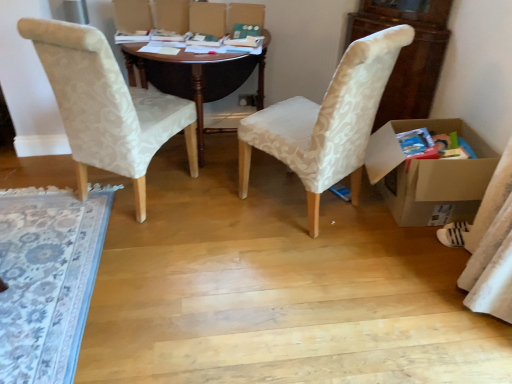
What is the approximate height of cardboard box at right?

cardboard box at right is 17.64 inches tall.

The image size is (512, 384). I want to click on white fabric sock at lower right, so click(453, 234).

What do you see at coordinates (106, 106) in the screenshot?
I see `matte white fabric chair at left, marked as the first chair in a left-to-right arrangement` at bounding box center [106, 106].

At what (x,y) coordinates should I click in order to perform the action: click on cardboard box at right. Please return your answer as a coordinate pair (x, y). This screenshot has height=384, width=512. Looking at the image, I should click on (426, 177).

Which object is positioned more to the left, patterned fabric rug at left or white fabric sock at lower right?

patterned fabric rug at left.

From a real-world perspective, is patterned fabric rug at left located higher than white fabric sock at lower right?

Incorrect, from a real-world perspective, patterned fabric rug at left is lower than white fabric sock at lower right.

Considering the relative sizes of patterned fabric rug at left and white fabric sock at lower right in the image provided, is patterned fabric rug at left thinner than white fabric sock at lower right?

No.

Considering the sizes of objects patterned fabric rug at left and white fabric sock at lower right in the image provided, who is smaller, patterned fabric rug at left or white fabric sock at lower right?

white fabric sock at lower right.

In the scene shown: Which is in front, matte white fabric chair at left, marked as the first chair in a left-to-right arrangement, or white fabric sock at lower right?

matte white fabric chair at left, marked as the first chair in a left-to-right arrangement.

Could you tell me if matte white fabric chair at left, marked as the first chair in a left-to-right arrangement, is facing white fabric sock at lower right?

No, matte white fabric chair at left, marked as the first chair in a left-to-right arrangement, is not aimed at white fabric sock at lower right.

From a real-world perspective, who is located higher, matte white fabric chair at left, which is counted as the 2th chair, starting from the right, or white fabric sock at lower right?

In real-world perspective, matte white fabric chair at left, which is counted as the 2th chair, starting from the right, is above.

Which of these two, matte white fabric chair at left, marked as the first chair in a left-to-right arrangement, or white fabric sock at lower right, stands taller?

matte white fabric chair at left, marked as the first chair in a left-to-right arrangement.

Which is behind, dark wood desk at center or matte white fabric chair at left, marked as the first chair in a left-to-right arrangement?

dark wood desk at center is further from the camera.

Considering the positions of point (184, 60) and point (109, 69), is point (184, 60) closer or farther from the camera than point (109, 69)?

Point (184, 60).

Is dark wood desk at center to the left of matte white fabric chair at left, marked as the first chair in a left-to-right arrangement, from the viewer's perspective?

Incorrect, dark wood desk at center is not on the left side of matte white fabric chair at left, marked as the first chair in a left-to-right arrangement.

Does dark wood desk at center have a greater width compared to matte white fabric chair at left, marked as the first chair in a left-to-right arrangement?

Yes, dark wood desk at center is wider than matte white fabric chair at left, marked as the first chair in a left-to-right arrangement.

Who is more distant, patterned fabric rug at left or dark wood desk at center?

dark wood desk at center is further away from the camera.

From the image's perspective, is patterned fabric rug at left under dark wood desk at center?

Yes.

This screenshot has width=512, height=384. Find the location of `mat below the dark wood desk at center (from the image's perspective)`. mat below the dark wood desk at center (from the image's perspective) is located at coordinates (47, 278).

Is patterned fabric rug at left touching dark wood desk at center?

patterned fabric rug at left and dark wood desk at center are clearly separated.

Which is more to the right, matte beige fabric chair at center, marked as the second chair in a left-to-right arrangement, or dark wood desk at center?

matte beige fabric chair at center, marked as the second chair in a left-to-right arrangement, is more to the right.

Could you tell me if matte beige fabric chair at center, marked as the 1th chair in a right-to-left arrangement, is facing dark wood desk at center?

Yes, matte beige fabric chair at center, marked as the 1th chair in a right-to-left arrangement, is facing dark wood desk at center.

Is point (241, 156) closer or farther from the camera than point (258, 72)?

Point (241, 156).

At what (x,y) coordinates should I click in order to perform the action: click on mat on the left of matte beige fabric chair at center, marked as the second chair in a left-to-right arrangement. Please return your answer as a coordinate pair (x, y). Looking at the image, I should click on (47, 278).

Is patterned fabric rug at left facing towards matte beige fabric chair at center, marked as the 1th chair in a right-to-left arrangement?

No.

Is patterned fabric rug at left spatially inside matte beige fabric chair at center, marked as the second chair in a left-to-right arrangement, or outside of it?

patterned fabric rug at left cannot be found inside matte beige fabric chair at center, marked as the second chair in a left-to-right arrangement.

Considering the sizes of objects matte white fabric chair at left, marked as the first chair in a left-to-right arrangement, and dark wood desk at center in the image provided, who is bigger, matte white fabric chair at left, marked as the first chair in a left-to-right arrangement, or dark wood desk at center?

Bigger between the two is dark wood desk at center.

There is a dark wood desk at center. Identify the location of the 1st chair above it (from a real-world perspective). The height and width of the screenshot is (384, 512). (106, 106).

Is point (196, 151) farther from camera compared to point (202, 153)?

No, (196, 151) is in front of (202, 153).

Is the position of matte white fabric chair at left, which is counted as the 2th chair, starting from the right, more distant than that of dark wood desk at center?

No, it is not.

Locate an element on the screen. This screenshot has width=512, height=384. mat lying in front of the white fabric sock at lower right is located at coordinates (47, 278).

The width and height of the screenshot is (512, 384). What are the coordinates of `footwear that is under the matte white fabric chair at left, which is counted as the 2th chair, starting from the right (from a real-world perspective)` in the screenshot? It's located at (453, 234).

Considering their positions, is dark wood desk at center positioned further to matte beige fabric chair at center, marked as the 1th chair in a right-to-left arrangement, than matte white fabric chair at left, marked as the first chair in a left-to-right arrangement?

dark wood desk at center.

Looking at the image, which one is located closer to patterned fabric rug at left, cardboard box at right or matte beige fabric chair at center, marked as the 1th chair in a right-to-left arrangement?

matte beige fabric chair at center, marked as the 1th chair in a right-to-left arrangement, lies closer to patterned fabric rug at left than the other object.

Considering their positions, is cardboard box at right positioned further to matte beige fabric chair at center, marked as the second chair in a left-to-right arrangement, than dark wood desk at center?

Among the two, dark wood desk at center is located further to matte beige fabric chair at center, marked as the second chair in a left-to-right arrangement.

Based on their spatial positions, is patterned fabric rug at left or dark wood desk at center further from matte white fabric chair at left, marked as the first chair in a left-to-right arrangement?

patterned fabric rug at left is further to matte white fabric chair at left, marked as the first chair in a left-to-right arrangement.

Considering their positions, is cardboard box at right positioned further to matte beige fabric chair at center, marked as the 1th chair in a right-to-left arrangement, than patterned fabric rug at left?

Among the two, patterned fabric rug at left is located further to matte beige fabric chair at center, marked as the 1th chair in a right-to-left arrangement.

Based on their spatial positions, is cardboard box at right or patterned fabric rug at left closer to white fabric sock at lower right?

cardboard box at right is closer to white fabric sock at lower right.

Looking at the image, which one is located further to matte white fabric chair at left, which is counted as the 2th chair, starting from the right, dark wood desk at center or cardboard box at right?

A: cardboard box at right lies further to matte white fabric chair at left, which is counted as the 2th chair, starting from the right, than the other object.

Estimate the real-world distances between objects in this image. Which object is further from dark wood desk at center, cardboard box at right or patterned fabric rug at left?

cardboard box at right.

Image resolution: width=512 pixels, height=384 pixels. Identify the location of box between dark wood desk at center and white fabric sock at lower right in the horizontal direction. (426, 177).

Where is `box located between matte white fabric chair at left, which is counted as the 2th chair, starting from the right, and white fabric sock at lower right in the left-right direction`? box located between matte white fabric chair at left, which is counted as the 2th chair, starting from the right, and white fabric sock at lower right in the left-right direction is located at coordinates (426, 177).

The width and height of the screenshot is (512, 384). In order to click on desk located between patterned fabric rug at left and white fabric sock at lower right in the left-right direction in this screenshot , I will do `click(198, 79)`.

Where is `chair between matte white fabric chair at left, which is counted as the 2th chair, starting from the right, and white fabric sock at lower right from left to right`? The width and height of the screenshot is (512, 384). chair between matte white fabric chair at left, which is counted as the 2th chair, starting from the right, and white fabric sock at lower right from left to right is located at coordinates (327, 122).